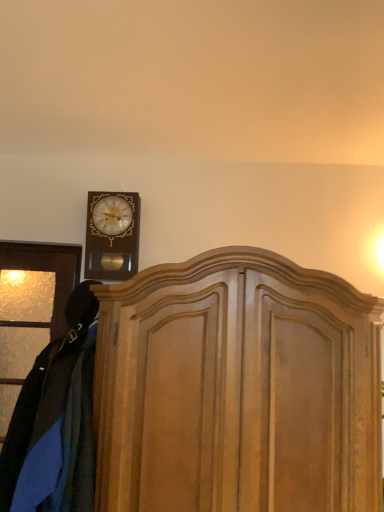
Question: Would you say wooden wall clock at upper left is a long distance from velvet blue coat at left?

Choices:
 (A) yes
 (B) no

Answer: (B)

Question: Does wooden wall clock at upper left have a lesser height compared to velvet blue coat at left?

Choices:
 (A) yes
 (B) no

Answer: (A)

Question: Can you confirm if wooden wall clock at upper left is positioned to the right of velvet blue coat at left?

Choices:
 (A) no
 (B) yes

Answer: (B)

Question: From the image's perspective, is wooden wall clock at upper left below velvet blue coat at left?

Choices:
 (A) yes
 (B) no

Answer: (B)

Question: Can you confirm if wooden wall clock at upper left is thinner than velvet blue coat at left?

Choices:
 (A) yes
 (B) no

Answer: (A)

Question: Is wooden wall clock at upper left not inside velvet blue coat at left?

Choices:
 (A) yes
 (B) no

Answer: (A)

Question: Does velvet blue coat at left have a lesser height compared to wooden wall clock at upper left?

Choices:
 (A) no
 (B) yes

Answer: (A)

Question: Can you confirm if velvet blue coat at left is positioned to the right of wooden wall clock at upper left?

Choices:
 (A) no
 (B) yes

Answer: (A)

Question: Is velvet blue coat at left looking in the opposite direction of wooden wall clock at upper left?

Choices:
 (A) yes
 (B) no

Answer: (B)

Question: From the image's perspective, is velvet blue coat at left above wooden wall clock at upper left?

Choices:
 (A) no
 (B) yes

Answer: (A)

Question: Is wooden wall clock at upper left completely or partially inside velvet blue coat at left?

Choices:
 (A) no
 (B) yes

Answer: (A)

Question: From the image's perspective, is velvet blue coat at left under wooden wall clock at upper left?

Choices:
 (A) no
 (B) yes

Answer: (B)

Question: From the image's perspective, is wooden dresser at center below velvet blue coat at left?

Choices:
 (A) yes
 (B) no

Answer: (A)